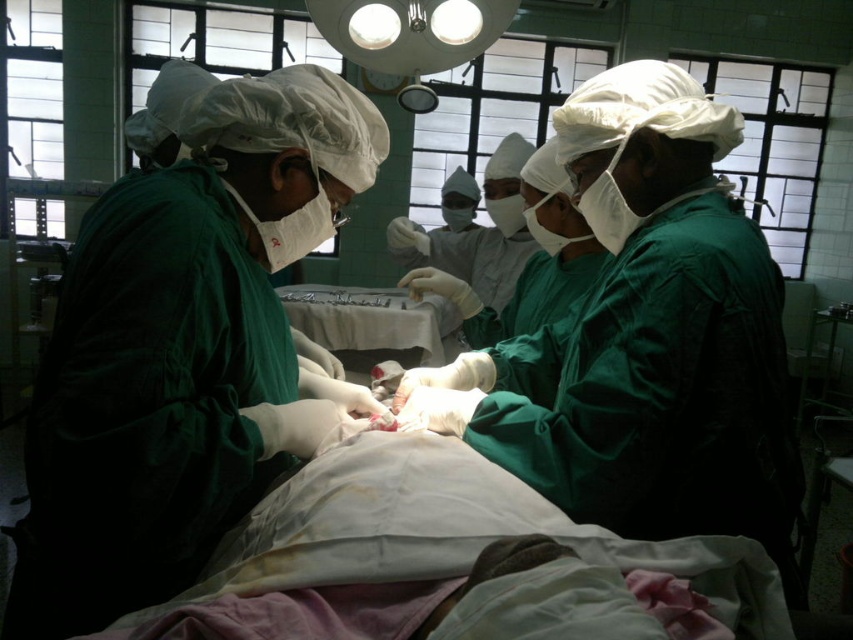
Does green matte surgical gown at center lie behind satin white tray at center?

No, green matte surgical gown at center is closer to the viewer.

Find the location of a particular element. green matte surgical gown at center is located at coordinates (184, 352).